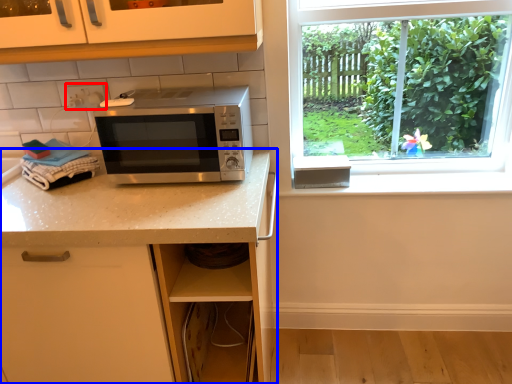
Question: Which object appears closest to the camera in this image, electric outlet (highlighted by a red box) or countertop (highlighted by a blue box)?

Choices:
 (A) electric outlet
 (B) countertop

Answer: (B)